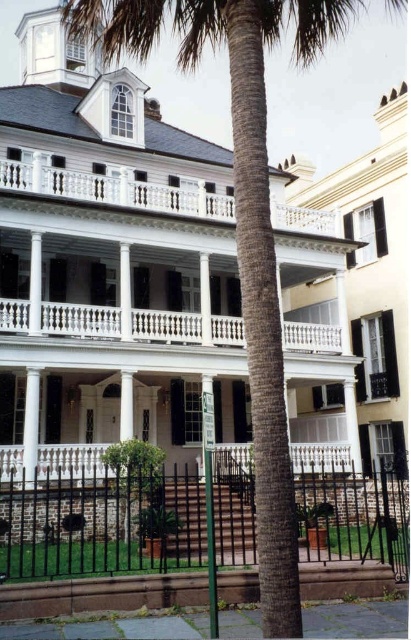
You are standing at the entrance of the grand historic building and want to locate the white wood porch at upper center. According to the coordinates provided, where would you look to find it?

The white wood porch at upper center is located at the 2D coordinates point [115,189], so you should look towards the upper center area of the building to find it.

You are a visitor standing in front of the historic building. You notice the black wrought iron fence at lower center and the white balustrade at center. Which object appears larger in size?

The black wrought iron fence at lower center is bigger than the white balustrade at center, so it appears larger in size.